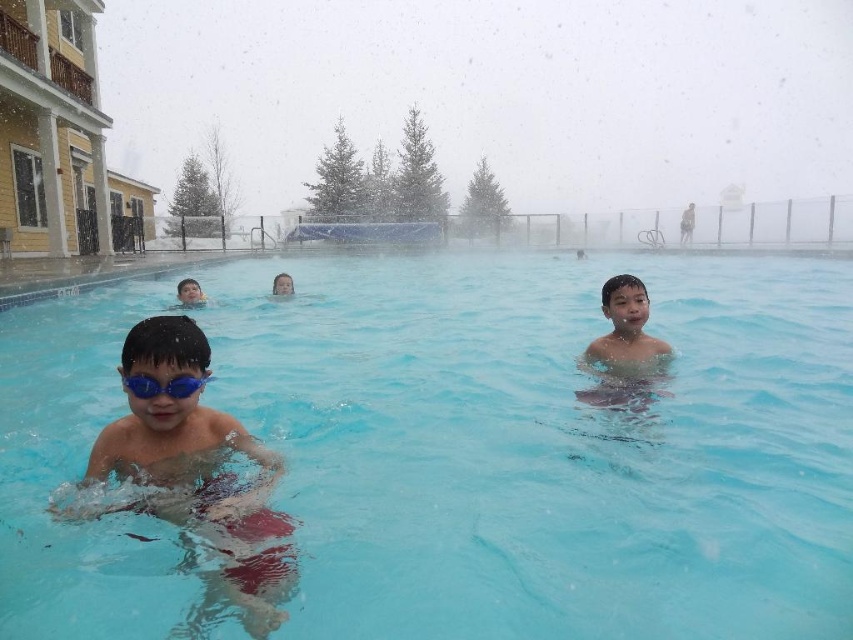
I want to click on matte blue goggles at center, so click(202, 493).

The height and width of the screenshot is (640, 853). Describe the element at coordinates (202, 493) in the screenshot. I see `matte blue goggles at center` at that location.

Where is `matte blue goggles at center`? Image resolution: width=853 pixels, height=640 pixels. matte blue goggles at center is located at coordinates 202,493.

Is matte blue goggles at center wider than blue matte goggles at upper center?

Indeed, matte blue goggles at center has a greater width compared to blue matte goggles at upper center.

This screenshot has width=853, height=640. Describe the element at coordinates (202, 493) in the screenshot. I see `matte blue goggles at center` at that location.

Who is more forward, (x=286, y=520) or (x=204, y=300)?

Positioned in front is point (x=286, y=520).

This screenshot has width=853, height=640. I want to click on matte blue goggles at center, so click(x=202, y=493).

Who is more forward, (267, 428) or (215, 436)?

Positioned in front is point (215, 436).

Is clear blue water at center to the left of matte blue goggles at center from the viewer's perspective?

Incorrect, clear blue water at center is not on the left side of matte blue goggles at center.

Where is `clear blue water at center`? The image size is (853, 640). clear blue water at center is located at coordinates (549, 445).